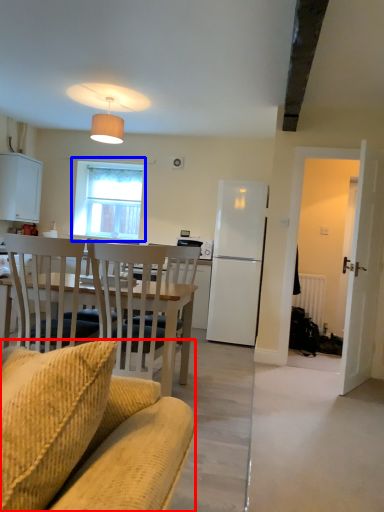
Question: Among these objects, which one is farthest to the camera, chair (highlighted by a red box) or window (highlighted by a blue box)?

Choices:
 (A) chair
 (B) window

Answer: (B)